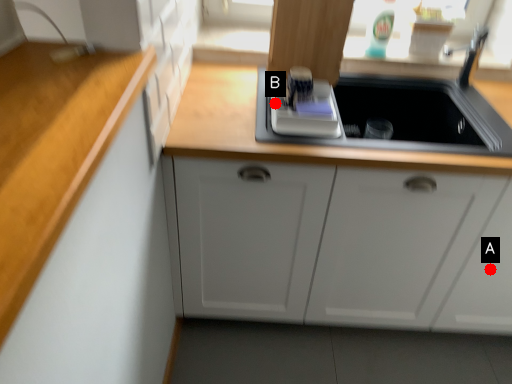
Question: Two points are circled on the image, labeled by A and B beside each circle. Which of the following is the closest to the observer?

Choices:
 (A) A is closer
 (B) B is closer

Answer: (B)